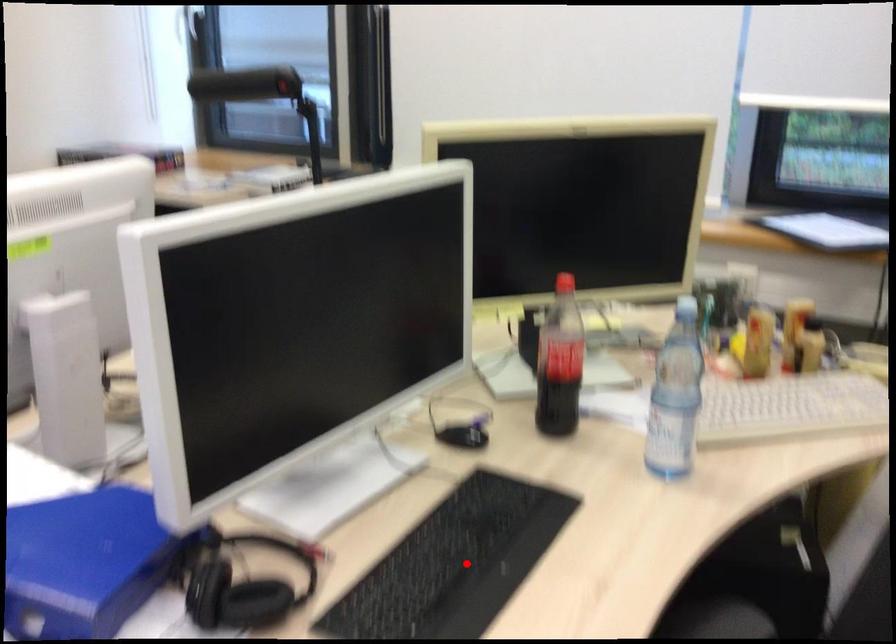
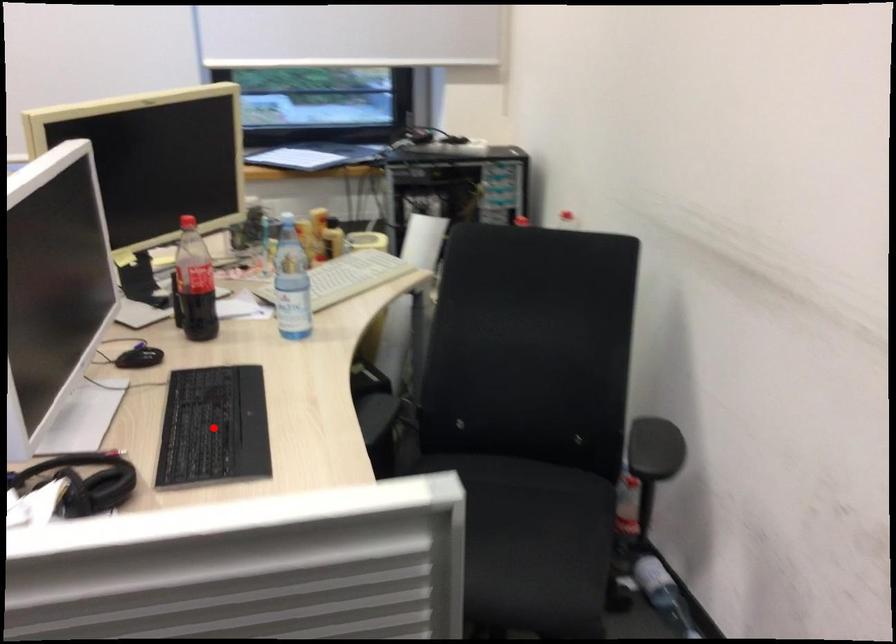
I am providing you with two images of the same scene from different viewpoints. A red point is marked on the first image and another point is marked on the second image. Does the point marked in image1 correspond to the same location as the one in image2?

Yes